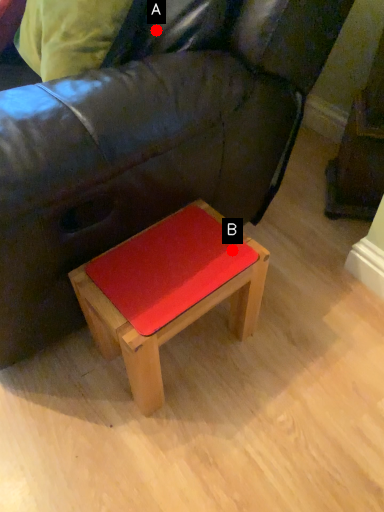
Question: Two points are circled on the image, labeled by A and B beside each circle. Which point is farther from the camera taking this photo?

Choices:
 (A) A is further
 (B) B is further

Answer: (B)